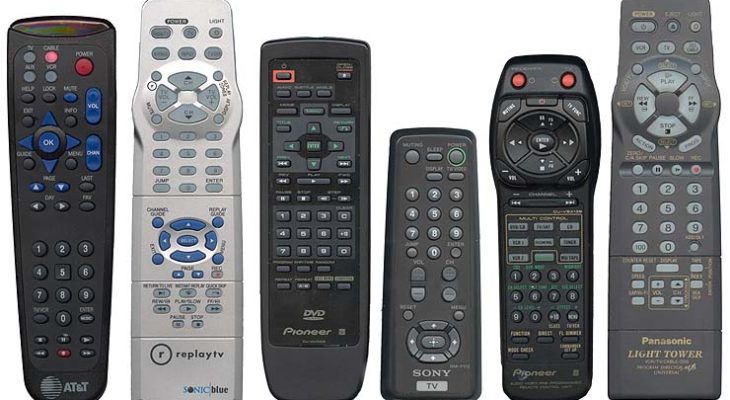
Where is `remote controls`? remote controls is located at coordinates (58, 196), (188, 194), (317, 190), (426, 216), (531, 214), (679, 182).